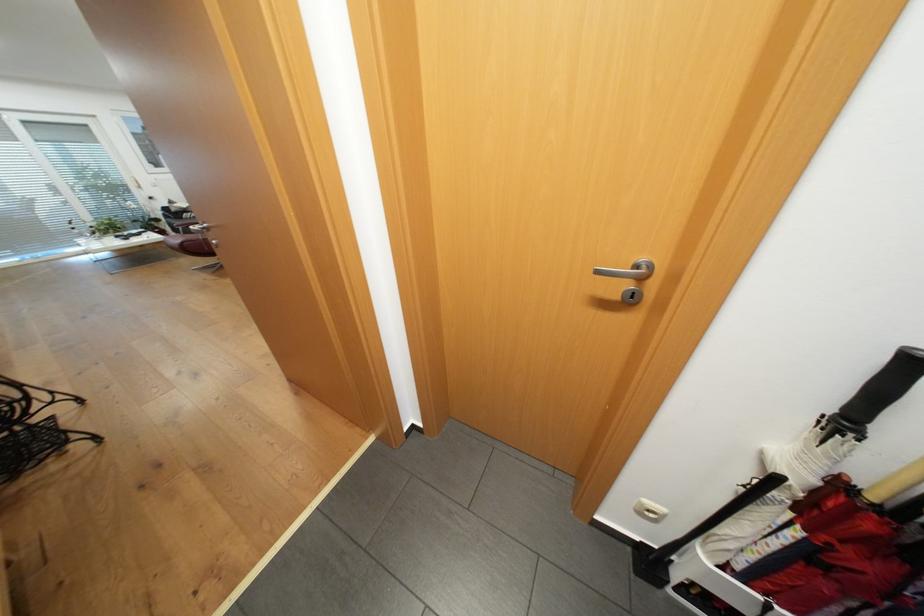
I want to click on chair sitting surface, so click(32, 427).